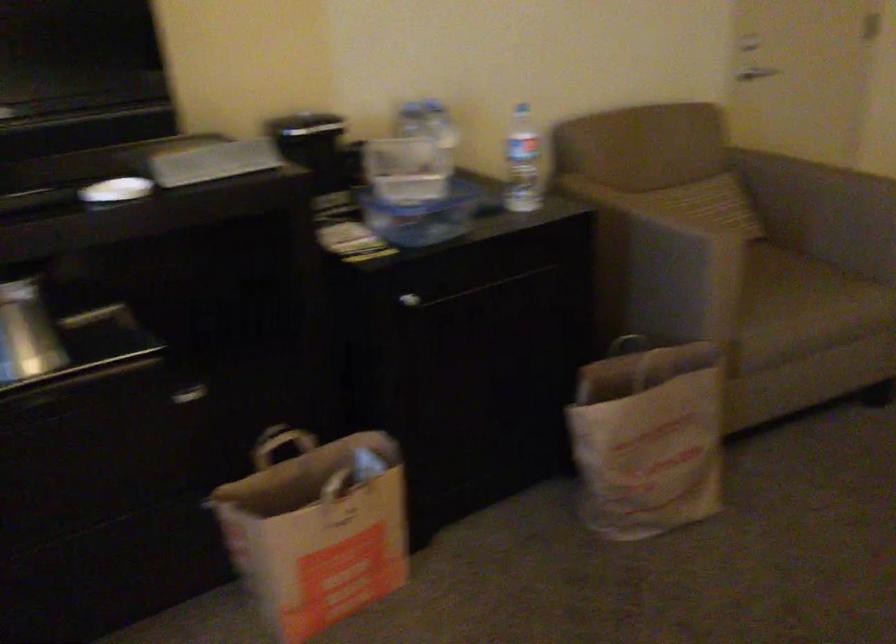
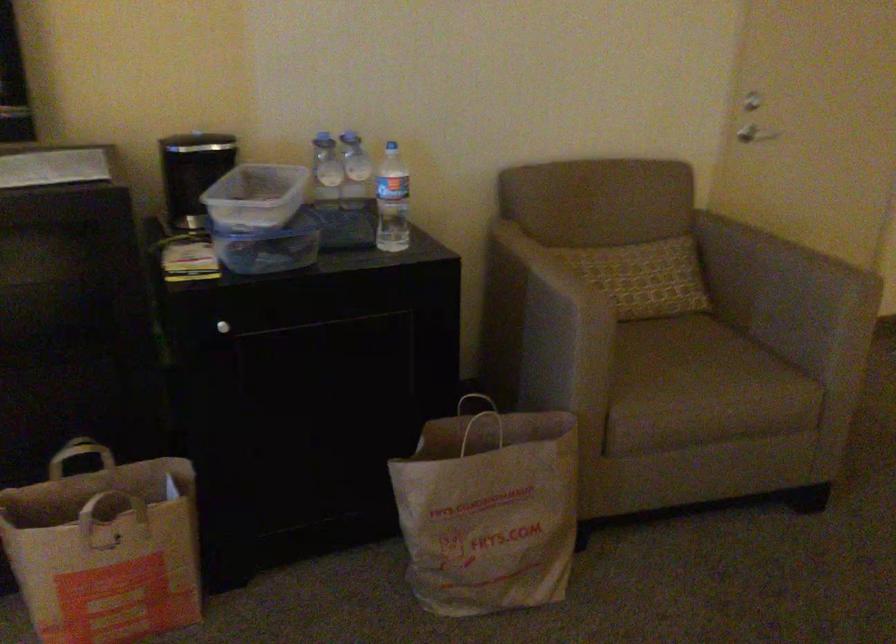
Where in the second image is the point corresponding to point 286,447 from the first image?

(82, 458)